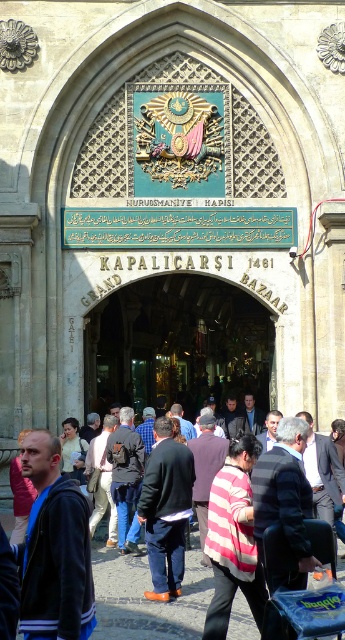
Is point (61, 483) in front of point (166, 547)?

Yes, it is in front of point (166, 547).

Can you confirm if dark blue jacket at lower left is positioned to the right of dark blue jeans at center?

In fact, dark blue jacket at lower left is to the left of dark blue jeans at center.

Is point (50, 634) positioned in front of point (182, 445)?

Yes.

Image resolution: width=345 pixels, height=640 pixels. Identify the location of dark blue jacket at lower left. (54, 548).

Who is more distant from viewer, (100, 579) or (156, 552)?

Positioned behind is point (100, 579).

Is point (144, 572) closer to viewer compared to point (166, 445)?

No, it is not.

Who is more forward, (115, 602) or (150, 499)?

Point (115, 602) is more forward.

Image resolution: width=345 pixels, height=640 pixels. I want to click on striped fabric crowd at center, so click(x=144, y=600).

Between dark blue jacket at lower left and striped fabric crowd at center, which one appears on the right side from the viewer's perspective?

From the viewer's perspective, striped fabric crowd at center appears more on the right side.

Is dark blue jacket at lower left shorter than striped fabric crowd at center?

No.

Is point (82, 627) closer to viewer compared to point (93, 580)?

Yes, it is in front of point (93, 580).

This screenshot has width=345, height=640. Identify the location of dark blue jacket at lower left. (54, 548).